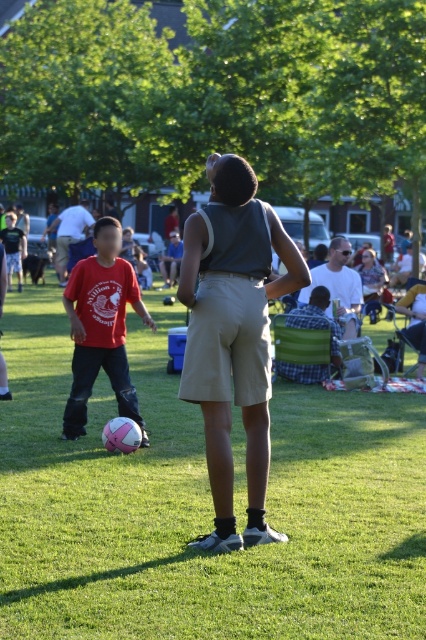
Question: Which object appears closest to the camera in this image?

Choices:
 (A) red cotton shirt at left
 (B) checkered fabric shirt at center
 (C) matte gray tank top at center

Answer: (B)

Question: Is checkered fabric shirt at center in front of matte white shirt at center?

Choices:
 (A) yes
 (B) no

Answer: (A)

Question: Does khaki shorts at center appear on the left side of red cotton shirt at left?

Choices:
 (A) no
 (B) yes

Answer: (A)

Question: Among these objects, which one is nearest to the camera?

Choices:
 (A) checkered fabric shirt at center
 (B) green grass at center
 (C) khaki shorts at center
 (D) red cotton shirt at left

Answer: (B)

Question: Does red cotton shirt at left appear on the right side of matte gray tank top at center?

Choices:
 (A) yes
 (B) no

Answer: (B)

Question: Which object is the farthest from the matte red shirt at left?

Choices:
 (A) matte white shirt at center
 (B) matte gray tank top at center
 (C) red cotton shirt at left
 (D) green grass at center

Answer: (C)